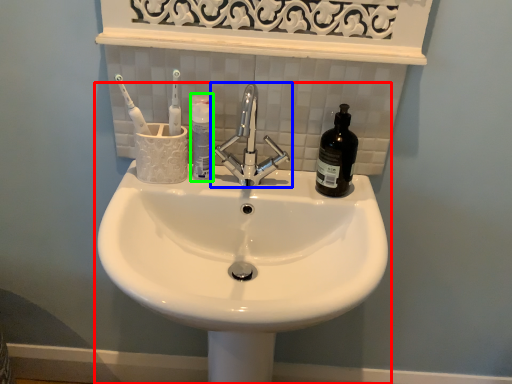
Question: Based on their relative distances, which object is nearer to sink (highlighted by a red box)? Choose from tap (highlighted by a blue box) and mouthwash (highlighted by a green box).

Choices:
 (A) tap
 (B) mouthwash

Answer: (A)